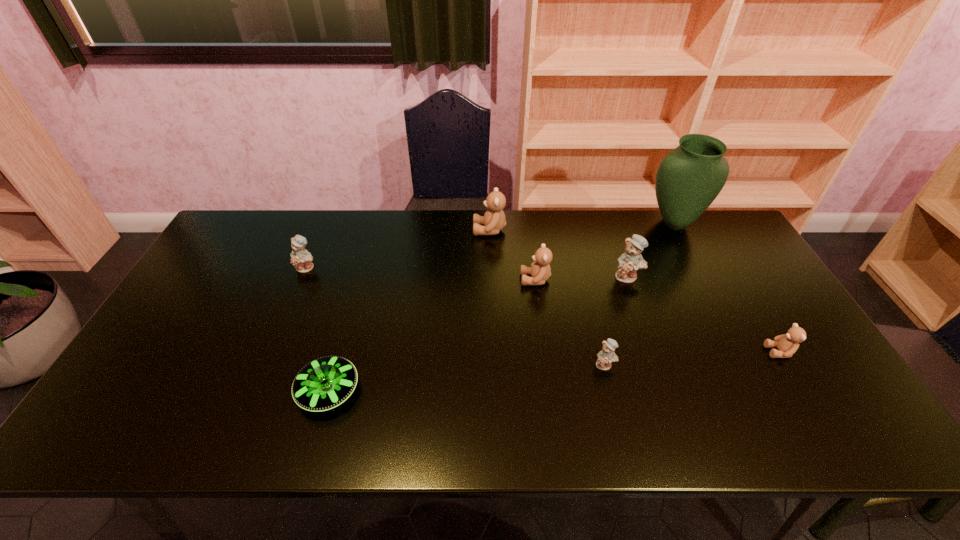
At what (x,y) coordinates should I click in order to perform the action: click on vacant space at the far right corner. Please return your answer as a coordinate pair (x, y). The image size is (960, 540). Looking at the image, I should click on (709, 234).

The image size is (960, 540). Identify the location of free spot at the near right corner of the desktop. (810, 422).

The image size is (960, 540). I want to click on vacant area that lies between the smallest blue teddy bear and the farthest teddy bear, so click(x=547, y=298).

Locate an element on the screen. This screenshot has height=540, width=960. free space between the seventh object from right to left and the vase is located at coordinates (501, 307).

The image size is (960, 540). I want to click on free space between the farthest teddy bear and the rightmost blue teddy bear, so click(559, 253).

Find the location of a particular element. Image resolution: width=960 pixels, height=540 pixels. free space that is in between the green saucer and the green vase is located at coordinates (501, 307).

In order to click on vacant area that lies between the biggest blue teddy bear and the farthest teddy bear in this screenshot , I will do `click(559, 253)`.

Locate an element on the screen. The width and height of the screenshot is (960, 540). free space between the rightmost brown teddy bear and the seventh object from right to left is located at coordinates (554, 372).

Find the location of a particular element. The width and height of the screenshot is (960, 540). vacant area between the leftmost object and the fifth object from left to right is located at coordinates (456, 316).

The image size is (960, 540). In order to click on vacant area between the green vase and the biggest blue teddy bear in this screenshot , I will do `click(651, 250)`.